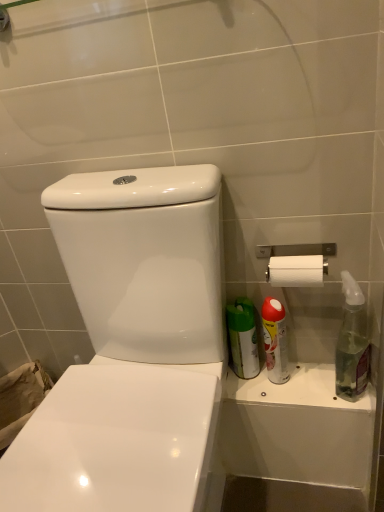
Question: Is the depth of white glossy toilet at center greater than that of clear glass spray bottle at right, positioned as the 2th cleaning product in left-to-right order?

Choices:
 (A) no
 (B) yes

Answer: (A)

Question: Does white glossy toilet at center appear on the right side of clear glass spray bottle at right, positioned as the 2th cleaning product in left-to-right order?

Choices:
 (A) yes
 (B) no

Answer: (B)

Question: Can you confirm if white glossy toilet at center is smaller than clear glass spray bottle at right, positioned as the 1th cleaning product in right-to-left order?

Choices:
 (A) no
 (B) yes

Answer: (A)

Question: Can you confirm if white glossy toilet at center is positioned to the left of clear glass spray bottle at right, positioned as the 1th cleaning product in right-to-left order?

Choices:
 (A) yes
 (B) no

Answer: (A)

Question: Does white glossy toilet at center come in front of clear glass spray bottle at right, positioned as the 2th cleaning product in left-to-right order?

Choices:
 (A) yes
 (B) no

Answer: (A)

Question: Is white glossy toilet at center outside of clear glass spray bottle at right, positioned as the 2th cleaning product in left-to-right order?

Choices:
 (A) no
 (B) yes

Answer: (B)

Question: Can you confirm if red matte spray can at right, positioned as the first cleaning product in left-to-right order, is wider than silver metallic toilet paper holder at upper right?

Choices:
 (A) no
 (B) yes

Answer: (A)

Question: Considering the relative sizes of red matte spray can at right, positioned as the first cleaning product in left-to-right order, and silver metallic toilet paper holder at upper right in the image provided, is red matte spray can at right, positioned as the first cleaning product in left-to-right order, shorter than silver metallic toilet paper holder at upper right?

Choices:
 (A) yes
 (B) no

Answer: (B)

Question: From the image's perspective, is red matte spray can at right, the second cleaning product in the right-to-left sequence, located beneath silver metallic toilet paper holder at upper right?

Choices:
 (A) no
 (B) yes

Answer: (B)

Question: Can you confirm if red matte spray can at right, positioned as the first cleaning product in left-to-right order, is taller than silver metallic toilet paper holder at upper right?

Choices:
 (A) no
 (B) yes

Answer: (B)

Question: From a real-world perspective, is red matte spray can at right, positioned as the first cleaning product in left-to-right order, located higher than silver metallic toilet paper holder at upper right?

Choices:
 (A) yes
 (B) no

Answer: (B)

Question: From the image's perspective, is red matte spray can at right, the second cleaning product in the right-to-left sequence, on top of silver metallic toilet paper holder at upper right?

Choices:
 (A) yes
 (B) no

Answer: (B)

Question: Is silver metallic toilet paper holder at upper right aimed at white glossy toilet at center?

Choices:
 (A) no
 (B) yes

Answer: (A)